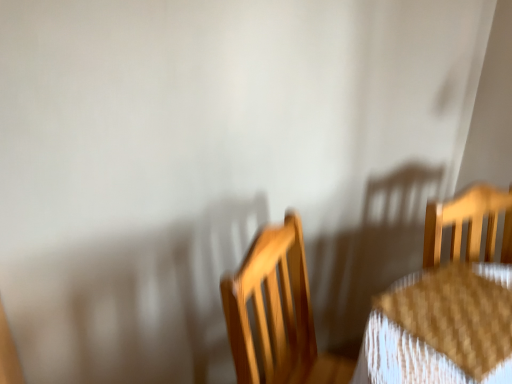
At what (x,y) coordinates should I click in order to perform the action: click on light wood chair at right. Please return your answer as a coordinate pair (x, y). Image resolution: width=512 pixels, height=384 pixels. Looking at the image, I should click on (447, 305).

What do you see at coordinates (447, 305) in the screenshot? I see `light wood chair at right` at bounding box center [447, 305].

At what (x,y) coordinates should I click in order to perform the action: click on light wood chair at right. Please return your answer as a coordinate pair (x, y). Looking at the image, I should click on (447, 305).